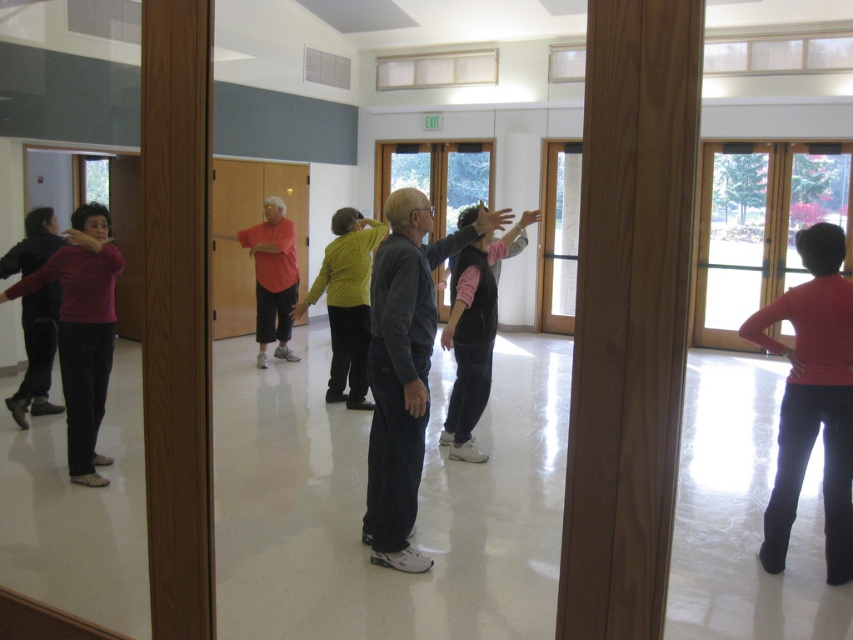
Question: Among these points, which one is farthest from the camera?

Choices:
 (A) 666,38
 (B) 486,394
 (C) 28,268
 (D) 86,428

Answer: (B)

Question: Is brown wood pillar at center further to camera compared to matte red sweater at right?

Choices:
 (A) no
 (B) yes

Answer: (A)

Question: Does brown wood pillar at center appear over velvet black vest at center?

Choices:
 (A) no
 (B) yes

Answer: (B)

Question: Is brown wood pillar at center to the left of matte black sweater at left from the viewer's perspective?

Choices:
 (A) no
 (B) yes

Answer: (A)

Question: Which object is the closest to the knitted yellow sweater at center?

Choices:
 (A) velvet black vest at center
 (B) pink fabric shirt at center
 (C) brown wood pillar at center
 (D) walnut wood pillar at left

Answer: (A)

Question: Which point appears closest to the camera in this image?

Choices:
 (A) [x=408, y=269]
 (B) [x=274, y=276]
 (C) [x=192, y=636]

Answer: (C)